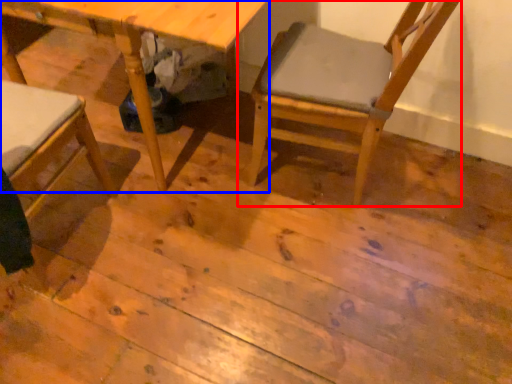
Question: Which object is closer to the camera taking this photo, chair (highlighted by a red box) or table (highlighted by a blue box)?

Choices:
 (A) chair
 (B) table

Answer: (A)